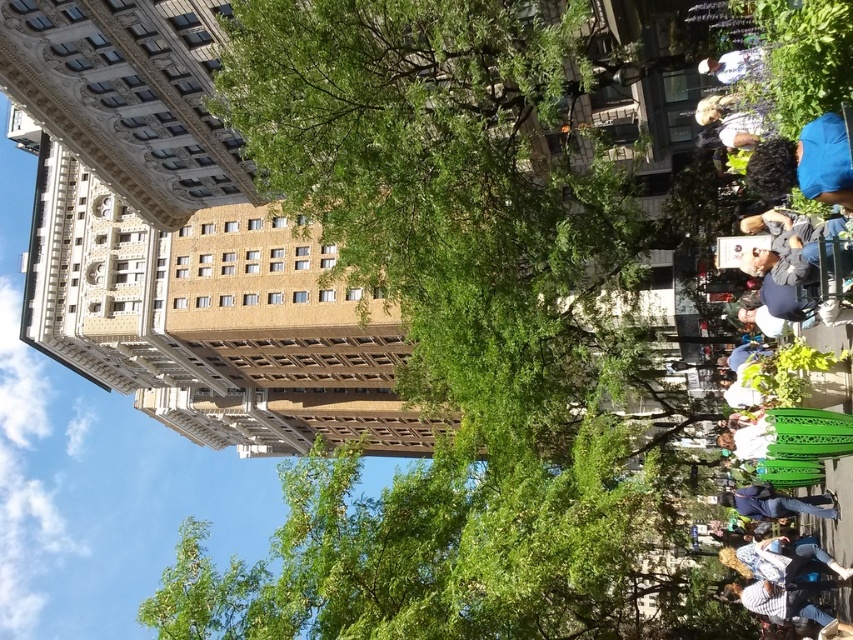
You are standing in the urban scene and want to walk from the point closer to you to the point further away. Which path would you take between the point at coordinates (613,364) and the point at coordinates (837,518)?

You should walk towards the point at coordinates (837,518) because it is further away from you compared to the point at (613,364), which is closer.

You are a delivery person trying to deliver a package to the building on the left. You notice a green leafy tree at center and a denim jacket at lower right. Which object is bigger in size?

A: The green leafy tree at center is larger in size than the denim jacket at lower right.

You are standing in the urban scene and want to walk from point (664, 445) to point (804, 188). Which direction should you move to get closer to your destination?

To move from point (664, 445) to point (804, 188), you should move towards the upper left direction since point (804, 188) is located in that direction relative to point (664, 445).